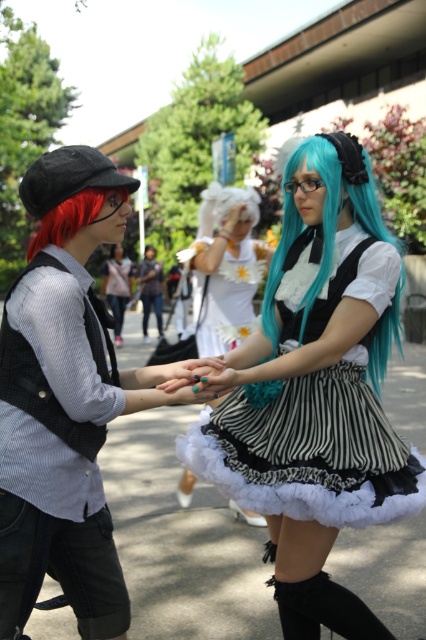
You are a photographer trying to capture the teal glossy wig at center in your shot. The camera is positioned at the origin point. Which direction should you move the camera to get the wig into the frame?

The teal glossy wig at center is located at point 0.417 on the x axis and 0.533 on the y axis. Since the camera is at the origin, you should move the camera to the right along the x axis and upwards along the y axis to center the wig in the frame.

What object is located at the coordinates point (227, 266) in the image?

The point (227, 266) corresponds to the teal glossy wig at center.

You are a photographer trying to capture a closeup shot of the teal nail polish at center. The black and white striped dress at center is blocking your view. Can you adjust your angle to take the photo without moving the dress?

The black and white striped dress at center is taller than the teal nail polish at center, so you might need to lower your camera angle to capture the teal nail polish at center without moving the dress.